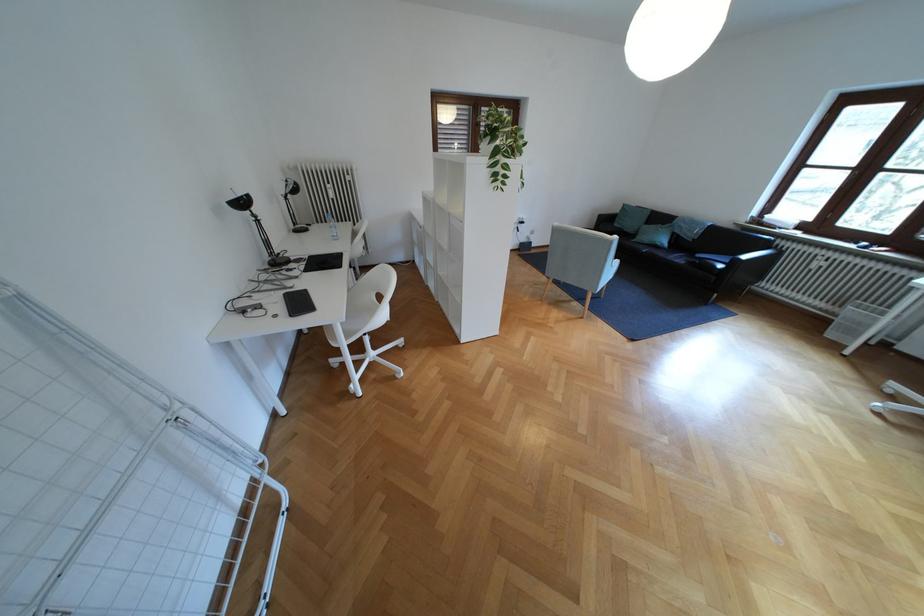
Where would you typ the laptop keyboard? Please return your answer as a coordinate pair (x, y).

(298, 302)